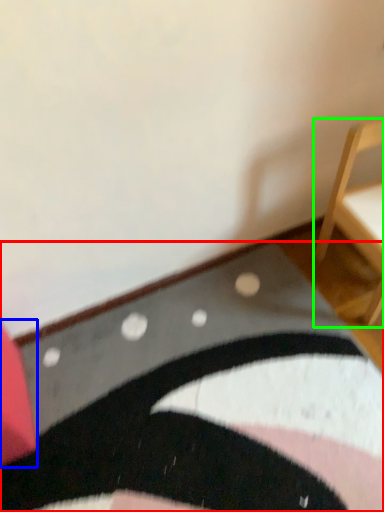
Question: Considering the real-world distances, which object is closest to mat (highlighted by a red box)? furniture (highlighted by a blue box) or furniture (highlighted by a green box).

Choices:
 (A) furniture
 (B) furniture

Answer: (A)